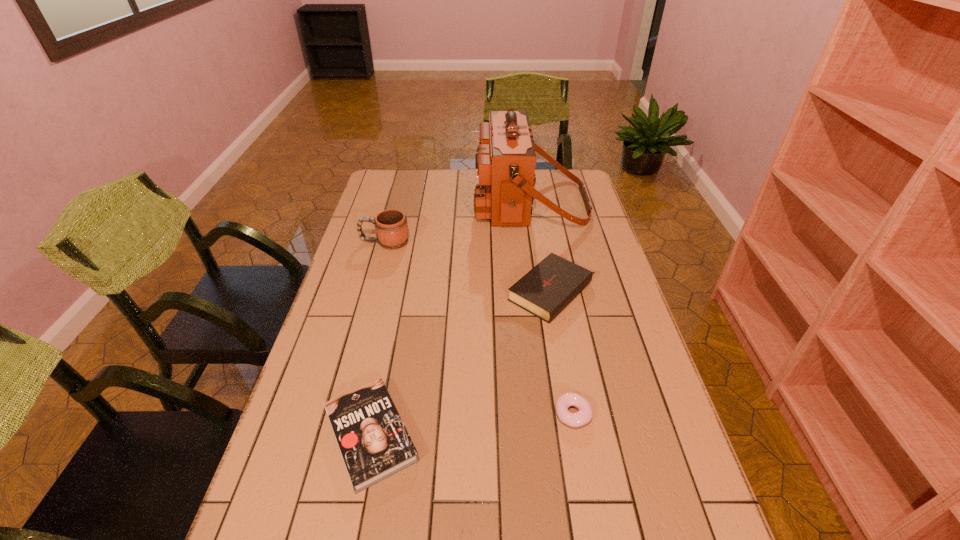
Identify the location of free space between the tallest object and the book. (450, 319).

Identify which object is the third nearest to the doughnut. Please provide its 2D coordinates. Your answer should be formatted as a tuple, i.e. [(x, y)], where the tuple contains the x and y coordinates of a point satisfying the conditions above.

[(505, 161)]

In order to click on object that is the second closest to the third nearest object in this screenshot , I will do `click(584, 415)`.

This screenshot has width=960, height=540. Identify the location of vacant region that satisfies the following two spatial constraints: 1. on the face side of the third nearest object; 2. on the right side of the tallest object. (544, 292).

In order to click on free space that satisfies the following two spatial constraints: 1. on the side of the book with the handle; 2. on the right side of the fourth shortest object in this screenshot , I will do `click(332, 435)`.

Image resolution: width=960 pixels, height=540 pixels. I want to click on free location that satisfies the following two spatial constraints: 1. on the side of the second tallest object with the handle; 2. on the right side of the third farthest object, so click(372, 292).

Locate an element on the screen. free point that satisfies the following two spatial constraints: 1. on the back side of the doughnut; 2. on the side of the fourth shortest object with the handle is located at coordinates (x=542, y=242).

I want to click on free point that satisfies the following two spatial constraints: 1. on the face side of the doughnut; 2. on the right side of the tallest object, so click(564, 414).